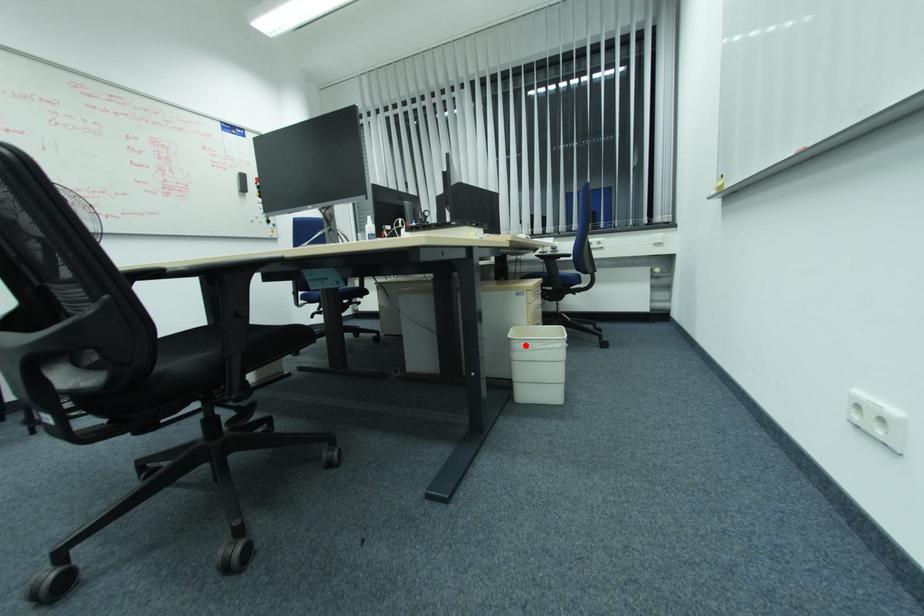
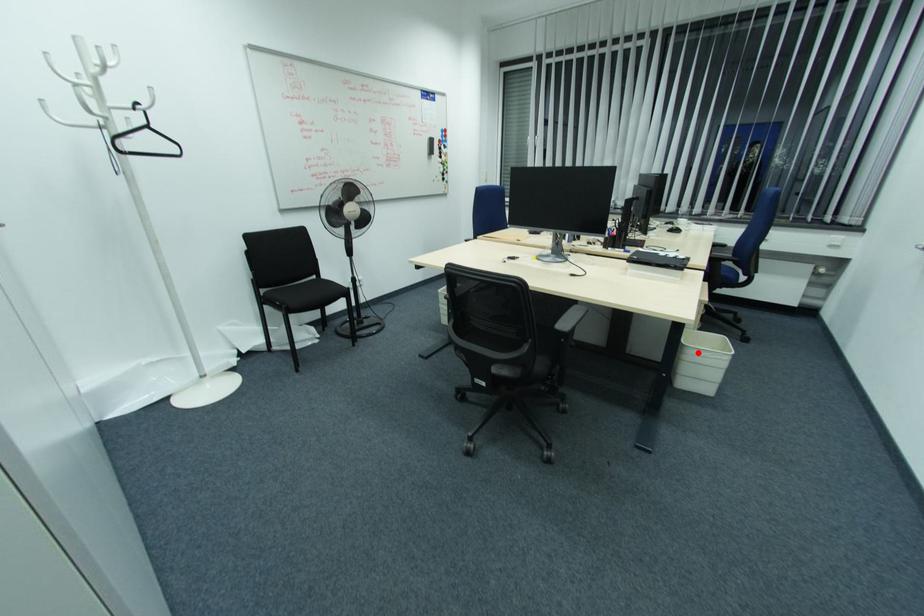
I am providing you with two images of the same scene from different viewpoints. A red point is marked on the first image and another point is marked on the second image. Is the red point in image1 aligned with the point shown in image2?

Yes